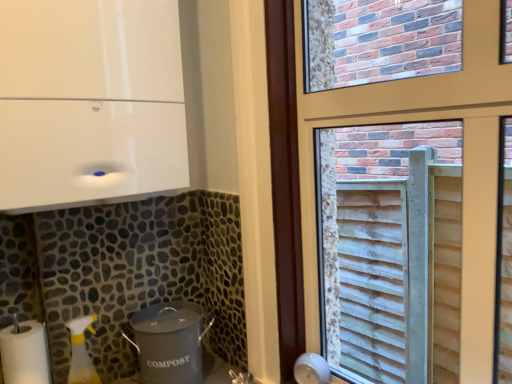
The image size is (512, 384). Describe the element at coordinates (90, 103) in the screenshot. I see `white glossy cabinet at upper left, which appears as the 2th appliance when ordered from the bottom` at that location.

The width and height of the screenshot is (512, 384). I want to click on white matte paper towel at lower left, so click(x=25, y=353).

What are the coordinates of `white glossy cabinet at upper left, which is counted as the first appliance, starting from the top` in the screenshot? It's located at (90, 103).

From a real-world perspective, is wooden slats at right positioned over white glossy cabinet at upper left, which is counted as the first appliance, starting from the top, based on gravity?

Actually, wooden slats at right is physically below white glossy cabinet at upper left, which is counted as the first appliance, starting from the top, in the real world.

Who is shorter, wooden slats at right or white glossy cabinet at upper left, which appears as the 2th appliance when ordered from the bottom?

white glossy cabinet at upper left, which appears as the 2th appliance when ordered from the bottom, is shorter.

Is wooden slats at right facing away from white glossy cabinet at upper left, which is counted as the first appliance, starting from the top?

wooden slats at right does not have its back to white glossy cabinet at upper left, which is counted as the first appliance, starting from the top.

Is wooden slats at right further to camera compared to white glossy cabinet at upper left, which is counted as the first appliance, starting from the top?

No, it is not.

Considering the sizes of white matte paper towel at lower left and gray matte compost bin at lower center, the 2th appliance viewed from the top, in the image, is white matte paper towel at lower left wider or thinner than gray matte compost bin at lower center, the 2th appliance viewed from the top,?

In the image, white matte paper towel at lower left appears to be more narrow than gray matte compost bin at lower center, the 2th appliance viewed from the top.

Would you say gray matte compost bin at lower center, which is counted as the 1th appliance, starting from the bottom, is part of white matte paper towel at lower left's contents?

No, gray matte compost bin at lower center, which is counted as the 1th appliance, starting from the bottom, is not surrounded by white matte paper towel at lower left.

Considering the relative sizes of white matte paper towel at lower left and gray matte compost bin at lower center, which is counted as the 1th appliance, starting from the bottom, in the image provided, is white matte paper towel at lower left shorter than gray matte compost bin at lower center, which is counted as the 1th appliance, starting from the bottom,?

In fact, white matte paper towel at lower left may be taller than gray matte compost bin at lower center, which is counted as the 1th appliance, starting from the bottom.

From the picture: Based on their positions, is white matte paper towel at lower left located to the left or right of gray matte compost bin at lower center, the 2th appliance viewed from the top?

white matte paper towel at lower left is to the left of gray matte compost bin at lower center, the 2th appliance viewed from the top.

Considering the sizes of gray matte compost bin at lower center, which is counted as the 1th appliance, starting from the bottom, and white glossy cabinet at upper left, which is counted as the first appliance, starting from the top, in the image, is gray matte compost bin at lower center, which is counted as the 1th appliance, starting from the bottom, taller or shorter than white glossy cabinet at upper left, which is counted as the first appliance, starting from the top,?

gray matte compost bin at lower center, which is counted as the 1th appliance, starting from the bottom, is shorter than white glossy cabinet at upper left, which is counted as the first appliance, starting from the top.

Considering the sizes of objects gray matte compost bin at lower center, which is counted as the 1th appliance, starting from the bottom, and white glossy cabinet at upper left, which appears as the 2th appliance when ordered from the bottom, in the image provided, who is thinner, gray matte compost bin at lower center, which is counted as the 1th appliance, starting from the bottom, or white glossy cabinet at upper left, which appears as the 2th appliance when ordered from the bottom,?

gray matte compost bin at lower center, which is counted as the 1th appliance, starting from the bottom, is thinner.

From the picture: How far apart are gray matte compost bin at lower center, which is counted as the 1th appliance, starting from the bottom, and white glossy cabinet at upper left, which appears as the 2th appliance when ordered from the bottom?

A distance of 21.35 inches exists between gray matte compost bin at lower center, which is counted as the 1th appliance, starting from the bottom, and white glossy cabinet at upper left, which appears as the 2th appliance when ordered from the bottom.

Is gray matte compost bin at lower center, which is counted as the 1th appliance, starting from the bottom, far from white glossy cabinet at upper left, which appears as the 2th appliance when ordered from the bottom?

No, there isn't a large distance between gray matte compost bin at lower center, which is counted as the 1th appliance, starting from the bottom, and white glossy cabinet at upper left, which appears as the 2th appliance when ordered from the bottom.

Is point (35, 373) positioned after point (99, 136)?

Yes, point (35, 373) is farther from viewer.

Is white matte paper towel at lower left far from white glossy cabinet at upper left, which is counted as the first appliance, starting from the top?

No, white matte paper towel at lower left is not far away from white glossy cabinet at upper left, which is counted as the first appliance, starting from the top.

How different are the orientations of white matte paper towel at lower left and white glossy cabinet at upper left, which is counted as the first appliance, starting from the top, in degrees?

The angular difference between white matte paper towel at lower left and white glossy cabinet at upper left, which is counted as the first appliance, starting from the top, is 0.00167 degrees.

Looking at this image, from a real-world perspective, is white matte paper towel at lower left above or below white glossy cabinet at upper left, which appears as the 2th appliance when ordered from the bottom?

In terms of real-world spatial position, white matte paper towel at lower left is below white glossy cabinet at upper left, which appears as the 2th appliance when ordered from the bottom.

From the image's perspective, which is above, wooden slats at right or gray matte compost bin at lower center, the 2th appliance viewed from the top?

wooden slats at right.

Would you say wooden slats at right contains gray matte compost bin at lower center, which is counted as the 1th appliance, starting from the bottom?

That's incorrect, gray matte compost bin at lower center, which is counted as the 1th appliance, starting from the bottom, is not inside wooden slats at right.

Who is smaller, wooden slats at right or gray matte compost bin at lower center, the 2th appliance viewed from the top?

Smaller between the two is gray matte compost bin at lower center, the 2th appliance viewed from the top.

Is wooden slats at right aimed at gray matte compost bin at lower center, the 2th appliance viewed from the top?

No.

Is white glossy cabinet at upper left, which is counted as the first appliance, starting from the top, to the right of white matte paper towel at lower left from the viewer's perspective?

Indeed, white glossy cabinet at upper left, which is counted as the first appliance, starting from the top, is positioned on the right side of white matte paper towel at lower left.

Is white glossy cabinet at upper left, which is counted as the first appliance, starting from the top, in contact with white matte paper towel at lower left?

There is a gap between white glossy cabinet at upper left, which is counted as the first appliance, starting from the top, and white matte paper towel at lower left.

Could you tell me if white glossy cabinet at upper left, which is counted as the first appliance, starting from the top, is facing white matte paper towel at lower left?

No, white glossy cabinet at upper left, which is counted as the first appliance, starting from the top, is not facing towards white matte paper towel at lower left.

Is white glossy cabinet at upper left, which is counted as the first appliance, starting from the top, at the right side of gray matte compost bin at lower center, which is counted as the 1th appliance, starting from the bottom?

Incorrect, white glossy cabinet at upper left, which is counted as the first appliance, starting from the top, is not on the right side of gray matte compost bin at lower center, which is counted as the 1th appliance, starting from the bottom.

Which of these two, white glossy cabinet at upper left, which is counted as the first appliance, starting from the top, or gray matte compost bin at lower center, the 2th appliance viewed from the top, is thinner?

gray matte compost bin at lower center, the 2th appliance viewed from the top.

From a real-world perspective, is white glossy cabinet at upper left, which is counted as the first appliance, starting from the top, positioned over gray matte compost bin at lower center, which is counted as the 1th appliance, starting from the bottom, based on gravity?

Indeed, from a real-world perspective, white glossy cabinet at upper left, which is counted as the first appliance, starting from the top, stands above gray matte compost bin at lower center, which is counted as the 1th appliance, starting from the bottom.

Is white glossy cabinet at upper left, which is counted as the first appliance, starting from the top, positioned with its back to gray matte compost bin at lower center, the 2th appliance viewed from the top?

No, white glossy cabinet at upper left, which is counted as the first appliance, starting from the top,'s orientation is not away from gray matte compost bin at lower center, the 2th appliance viewed from the top.

Starting from the wooden slats at right, which appliance is the 1st one behind? Please provide its 2D coordinates.

[(90, 103)]

At what (x,y) coordinates should I click in order to perform the action: click on paper towel above the gray matte compost bin at lower center, which is counted as the 1th appliance, starting from the bottom (from a real-world perspective). Please return your answer as a coordinate pair (x, y). The width and height of the screenshot is (512, 384). Looking at the image, I should click on (25, 353).

Consider the image. Considering their positions, is wooden slats at right positioned closer to white matte paper towel at lower left than gray matte compost bin at lower center, the 2th appliance viewed from the top?

Among the two, gray matte compost bin at lower center, the 2th appliance viewed from the top, is located nearer to white matte paper towel at lower left.

Based on their spatial positions, is white matte paper towel at lower left or gray matte compost bin at lower center, which is counted as the 1th appliance, starting from the bottom, closer to wooden slats at right?

Based on the image, gray matte compost bin at lower center, which is counted as the 1th appliance, starting from the bottom, appears to be nearer to wooden slats at right.

In the scene shown: Looking at the image, which one is located further to white glossy cabinet at upper left, which is counted as the first appliance, starting from the top, white matte paper towel at lower left or gray matte compost bin at lower center, which is counted as the 1th appliance, starting from the bottom?

white matte paper towel at lower left is further to white glossy cabinet at upper left, which is counted as the first appliance, starting from the top.

When comparing their distances from white glossy cabinet at upper left, which is counted as the first appliance, starting from the top, does gray matte compost bin at lower center, the 2th appliance viewed from the top, or white matte paper towel at lower left seem further?

white matte paper towel at lower left lies further to white glossy cabinet at upper left, which is counted as the first appliance, starting from the top, than the other object.

Estimate the real-world distances between objects in this image. Which object is further from white glossy cabinet at upper left, which is counted as the first appliance, starting from the top, white matte paper towel at lower left or wooden slats at right?

The object further to white glossy cabinet at upper left, which is counted as the first appliance, starting from the top, is white matte paper towel at lower left.

Looking at the image, which one is located closer to white matte paper towel at lower left, gray matte compost bin at lower center, the 2th appliance viewed from the top, or white glossy cabinet at upper left, which appears as the 2th appliance when ordered from the bottom?

gray matte compost bin at lower center, the 2th appliance viewed from the top, is closer to white matte paper towel at lower left.

Estimate the real-world distances between objects in this image. Which object is closer to white matte paper towel at lower left, wooden slats at right or white glossy cabinet at upper left, which is counted as the first appliance, starting from the top?

white glossy cabinet at upper left, which is counted as the first appliance, starting from the top, lies closer to white matte paper towel at lower left than the other object.

Based on the photo, looking at the image, which one is located closer to gray matte compost bin at lower center, the 2th appliance viewed from the top, wooden slats at right or white glossy cabinet at upper left, which appears as the 2th appliance when ordered from the bottom?

Among the two, wooden slats at right is located nearer to gray matte compost bin at lower center, the 2th appliance viewed from the top.

You are a GUI agent. You are given a task and a screenshot of the screen. Output one action in this format:
    pyautogui.click(x=<x>, y=<y>)
    Task: Click on the window between white glossy cabinet at upper left, which appears as the 2th appliance when ordered from the bottom, and gray matte compost bin at lower center, the 2th appliance viewed from the top, in the up-down direction
    
    Given the screenshot: What is the action you would take?
    pyautogui.click(x=390, y=122)

The width and height of the screenshot is (512, 384). What are the coordinates of `appliance that lies between white glossy cabinet at upper left, which is counted as the first appliance, starting from the top, and white matte paper towel at lower left from top to bottom` in the screenshot? It's located at (169, 342).